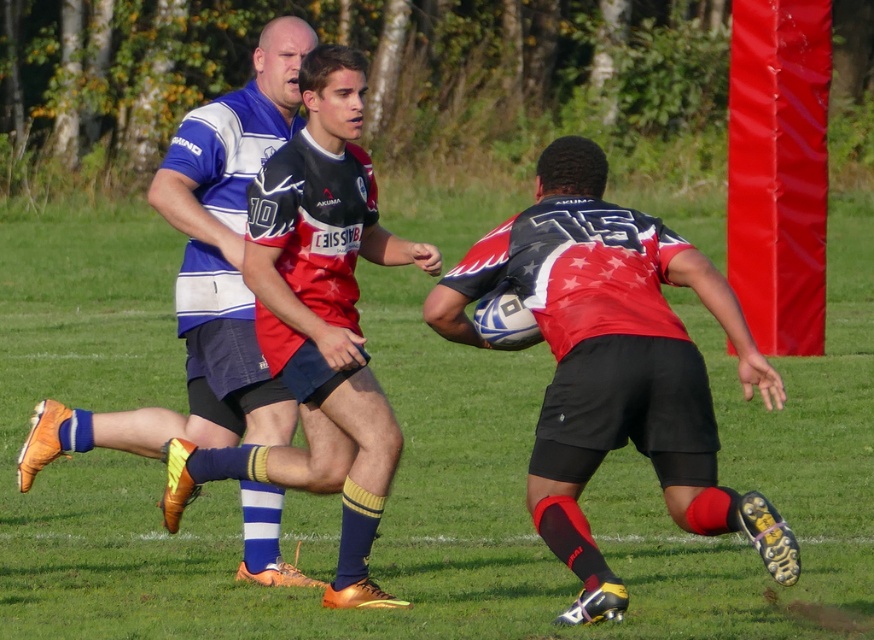
Who is more distant from viewer, [476,288] or [241,378]?

Positioned behind is point [241,378].

Does matte red rugby ball at center appear on the right side of blue/white striped jersey at upper left?

Correct, you'll find matte red rugby ball at center to the right of blue/white striped jersey at upper left.

Locate an element on the screen. The image size is (874, 640). matte red rugby ball at center is located at coordinates (615, 365).

Locate an element on the screen. This screenshot has height=640, width=874. matte red rugby ball at center is located at coordinates (615, 365).

In the scene shown: Could you measure the distance between green grass football field at center and blue/white striped jersey at upper left?

green grass football field at center is 9.04 meters away from blue/white striped jersey at upper left.

In the scene shown: Is green grass football field at center shorter than blue/white striped jersey at upper left?

No, green grass football field at center is not shorter than blue/white striped jersey at upper left.

Who is more distant from viewer, (812, 460) or (245, 100)?

The point (812, 460) is behind.

Locate an element on the screen. green grass football field at center is located at coordinates (413, 467).

Who is lower down, green grass football field at center or matte red rugby ball at center?

matte red rugby ball at center is below.

Is green grass football field at center taller than matte red rugby ball at center?

Indeed, green grass football field at center has a greater height compared to matte red rugby ball at center.

Is point (198, 592) positioned behind point (706, 435)?

Yes.

This screenshot has height=640, width=874. I want to click on green grass football field at center, so click(413, 467).